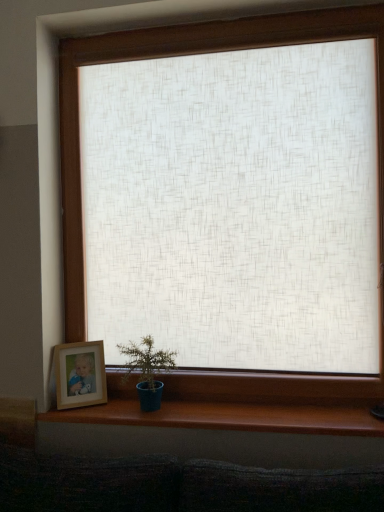
Find the location of a particular element. Image resolution: width=384 pixels, height=512 pixels. free space between wooden picture frame at lower left and blue matte pot at lower left is located at coordinates (95, 408).